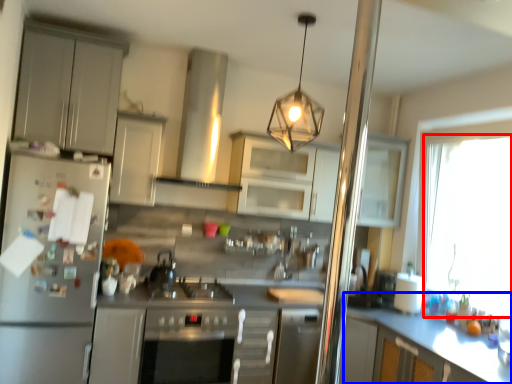
Question: Which point is closer to the camera, window (highlighted by a red box) or counter (highlighted by a blue box)?

Choices:
 (A) window
 (B) counter

Answer: (B)